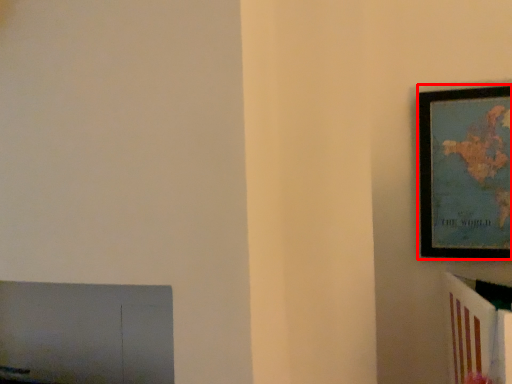
Question: Observing the image, what is the correct spatial positioning of picture frame (annotated by the red box) in reference to furniture?

Choices:
 (A) left
 (B) right

Answer: (B)